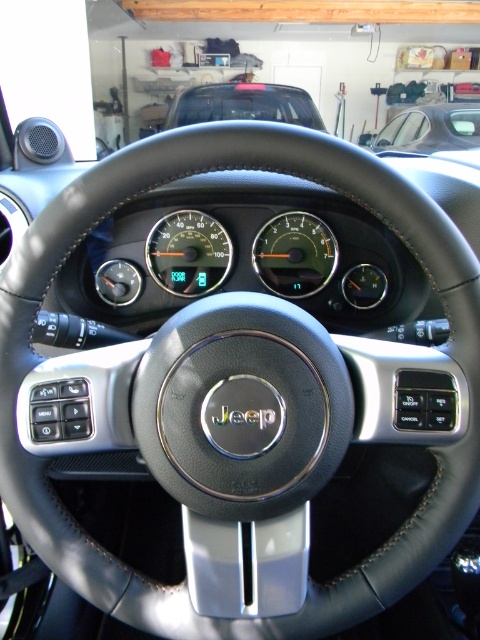
Question: Can you confirm if matte black speedometer at center is positioned below matte black car at upper center?

Choices:
 (A) yes
 (B) no

Answer: (A)

Question: Estimate the real-world distances between objects in this image. Which object is farther from the matte black gauge at center?

Choices:
 (A) matte black car at upper center
 (B) matte black speedometer at center
 (C) metallic silver car at upper right

Answer: (C)

Question: Is matte black gauge at center smaller than matte black car at upper center?

Choices:
 (A) yes
 (B) no

Answer: (A)

Question: Can you confirm if matte black speedometer at center is bigger than metallic silver car at upper right?

Choices:
 (A) yes
 (B) no

Answer: (B)

Question: Which object appears closest to the camera in this image?

Choices:
 (A) metallic silver car at upper right
 (B) matte black car at upper center

Answer: (B)

Question: Which point is farther to the camera?

Choices:
 (A) (204, 269)
 (B) (249, 109)
 (C) (454, 116)

Answer: (C)